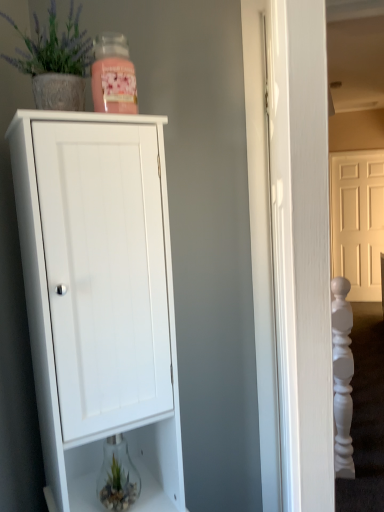
Question: In terms of height, does matte gray pot at upper left look taller or shorter compared to clear glass vase at lower center?

Choices:
 (A) short
 (B) tall

Answer: (B)

Question: In terms of size, does matte gray pot at upper left appear bigger or smaller than clear glass vase at lower center?

Choices:
 (A) big
 (B) small

Answer: (A)

Question: Estimate the real-world distances between objects in this image. Which object is closer to the matte gray pot at upper left?

Choices:
 (A) white matte cabinet at center
 (B) yellow matte door at upper right
 (C) clear glass vase at lower center

Answer: (A)

Question: Estimate the real-world distances between objects in this image. Which object is closer to the yellow matte door at upper right?

Choices:
 (A) matte gray pot at upper left
 (B) clear glass vase at lower center
 (C) white matte cabinet at center

Answer: (B)